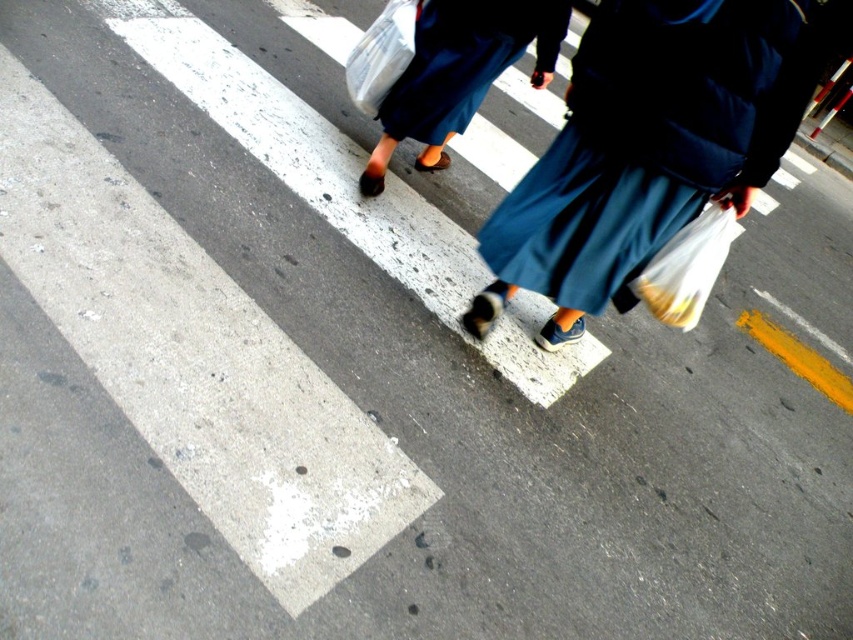
You are a delivery person who needs to place both the translucent plastic bag at lower right and the translucent plastic bag at upper center into a storage bin. Which bag should you place first to ensure both fit inside?

The translucent plastic bag at lower right should be placed first since it occupies less space than the translucent plastic bag at upper center, allowing more room for the larger bag afterward.

You are a photographer trying to capture the blue fabric skirt at center and the translucent plastic bag at upper center in a single frame. Considering their sizes, which object will appear wider in the photo?

The blue fabric skirt at center will appear wider in the photo because its width surpasses that of the translucent plastic bag at upper center.

You are a pedestrian standing on the sidewalk observing the crosswalk. You see the blue fabric skirt at center and the translucent plastic bag at lower right. Which object is closer to you?

The blue fabric skirt at center is closer to you because it is in front of the translucent plastic bag at lower right.